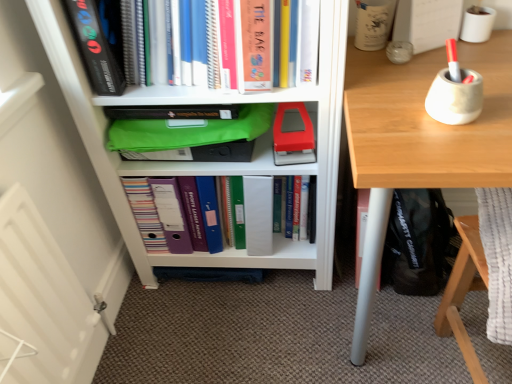
In order to click on unoccupied area in front of white matte pen holder at upper right, positioned as the fourth stationery in left-to-right order in this screenshot , I will do `click(490, 63)`.